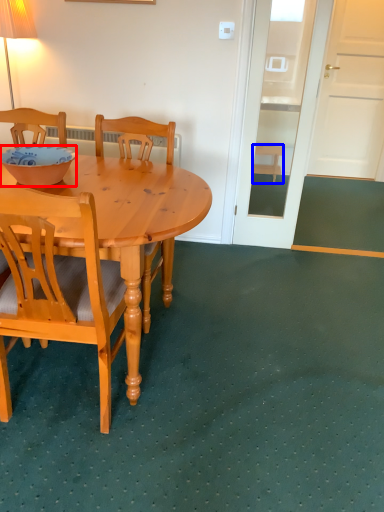
Question: Which point is closer to the camera, bowl (highlighted by a red box) or stool (highlighted by a blue box)?

Choices:
 (A) bowl
 (B) stool

Answer: (A)